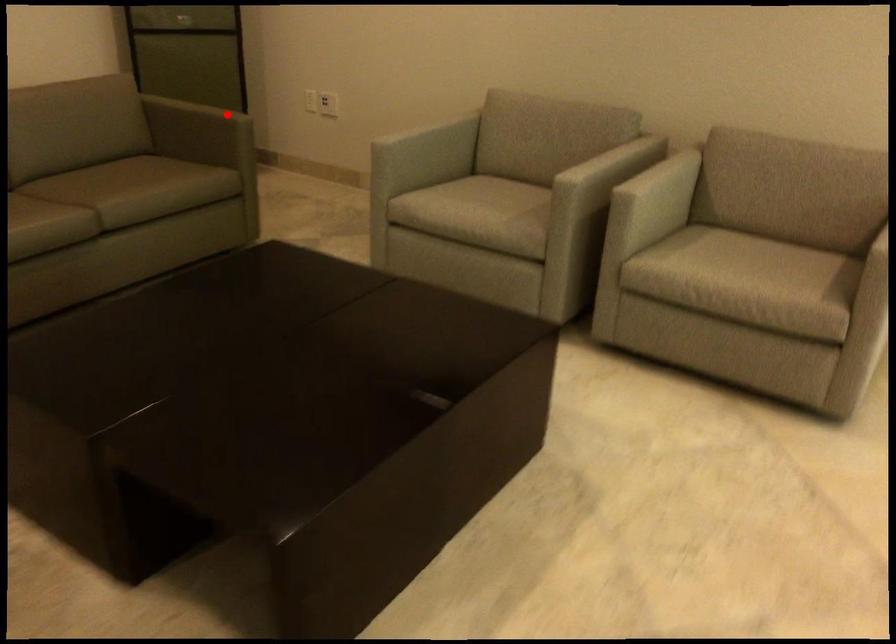
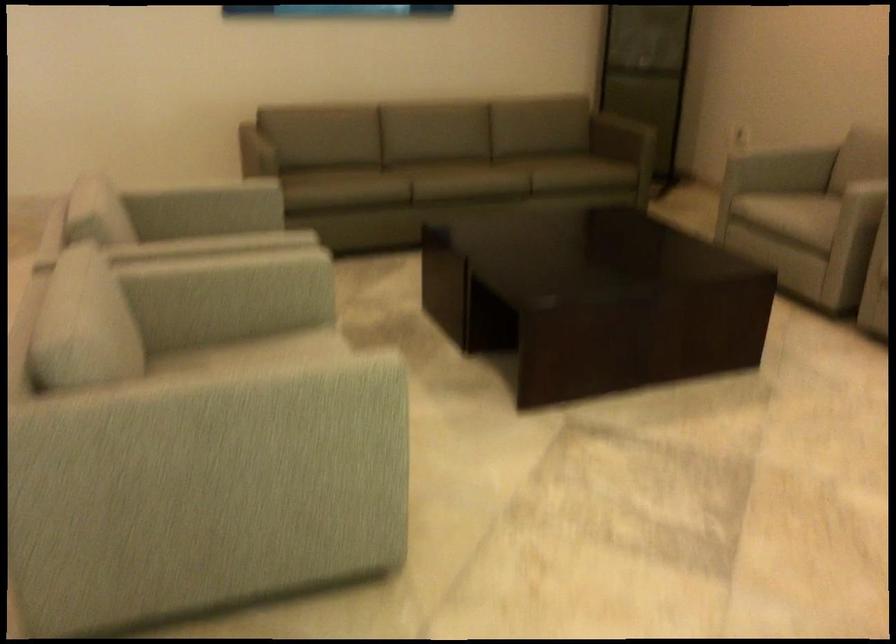
Question: I am providing you with two images of the same scene from different viewpoints. A red point is marked on the first image. Is the red point's position out of view in image 2?

Choices:
 (A) Yes
 (B) No

Answer: (B)